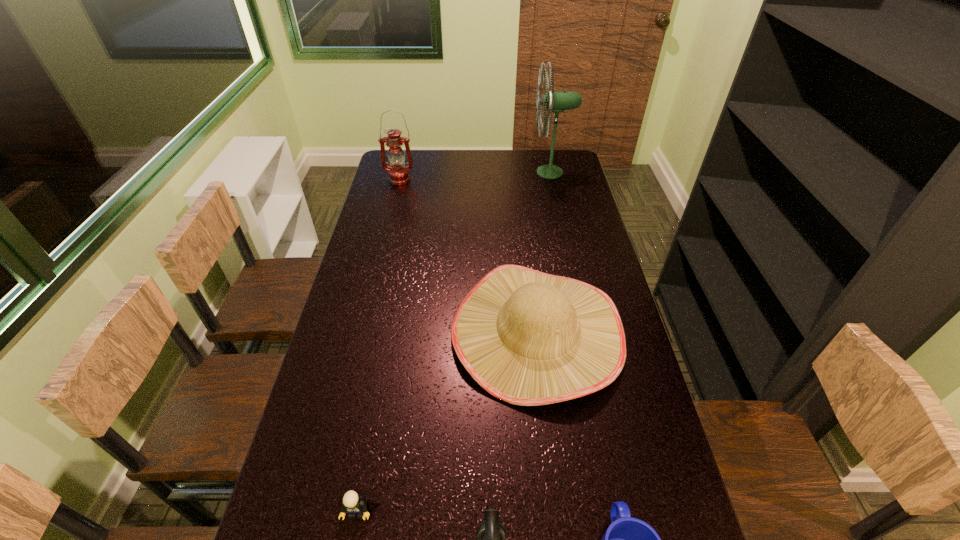
This screenshot has height=540, width=960. In the image, there is a desktop. Find the location of `vacant space at the far right corner`. vacant space at the far right corner is located at coordinates (575, 159).

Locate an element on the screen. The height and width of the screenshot is (540, 960). free space between the fifth shortest object and the tallest object is located at coordinates (474, 176).

Image resolution: width=960 pixels, height=540 pixels. Find the location of `vacant area between the tallest object and the sunhat`. vacant area between the tallest object and the sunhat is located at coordinates (544, 253).

Where is `free area in between the fan and the fifth shortest object`? free area in between the fan and the fifth shortest object is located at coordinates (474, 176).

Identify the location of empty space that is in between the Lego and the fifth shortest object. Image resolution: width=960 pixels, height=540 pixels. (378, 345).

Locate an element on the screen. This screenshot has height=540, width=960. vacant area that lies between the oil lamp and the third farthest object is located at coordinates (468, 256).

Where is `free spot between the tallest object and the oil lamp`? The height and width of the screenshot is (540, 960). free spot between the tallest object and the oil lamp is located at coordinates (474, 176).

Find the location of a particular element. the fourth closest object to the tallest object is located at coordinates (491, 539).

Point out which object is positioned as the nearest to the Lego. Please provide its 2D coordinates. Your answer should be formatted as a tuple, i.e. [(x, y)], where the tuple contains the x and y coordinates of a point satisfying the conditions above.

[(491, 539)]

Locate an element on the screen. This screenshot has height=540, width=960. vacant region that satisfies the following two spatial constraints: 1. on the front-facing side of the tallest object; 2. on the front-facing side of the Lego is located at coordinates (624, 510).